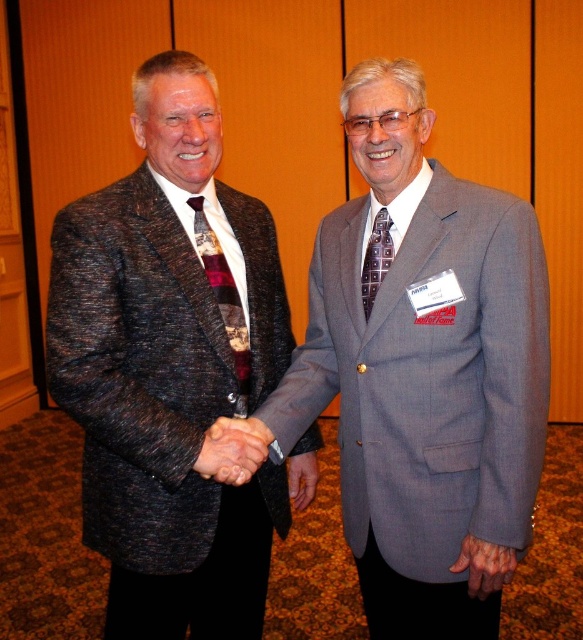
You are an event planner arranging a photo shoot. You need to position a backdrop to the left of the gray textured suit at center and to the right of the plaid fabric tie at center. Is this arrangement possible based on their current positions?

The gray textured suit at center is to the right of the plaid fabric tie at center, so placing the backdrop to the left of the gray textured suit at center and to the right of the plaid fabric tie at center is possible as they are positioned in a way that allows space between them for the backdrop.